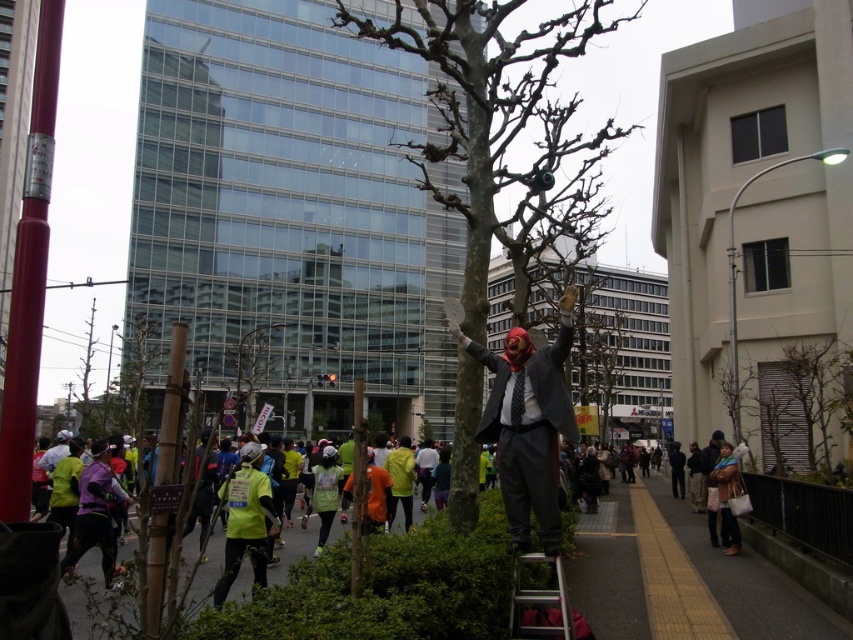
In the scene shown: Is matte black suit at center taller than silver metallic ladder at lower center?

Yes, matte black suit at center is taller than silver metallic ladder at lower center.

Find the location of `matte black suit at center`. matte black suit at center is located at coordinates (527, 433).

Which is below, bare wood tree at center or matte black suit at center?

matte black suit at center is below.

In order to click on bare wood tree at center in this screenshot , I will do `click(492, 113)`.

Is point (490, 195) positioned behind point (515, 563)?

That is True.

Where is `bare wood tree at center`? The height and width of the screenshot is (640, 853). bare wood tree at center is located at coordinates (492, 113).

I want to click on bare wood tree at center, so click(492, 113).

The height and width of the screenshot is (640, 853). What are the coordinates of `bare wood tree at center` in the screenshot? It's located at (492, 113).